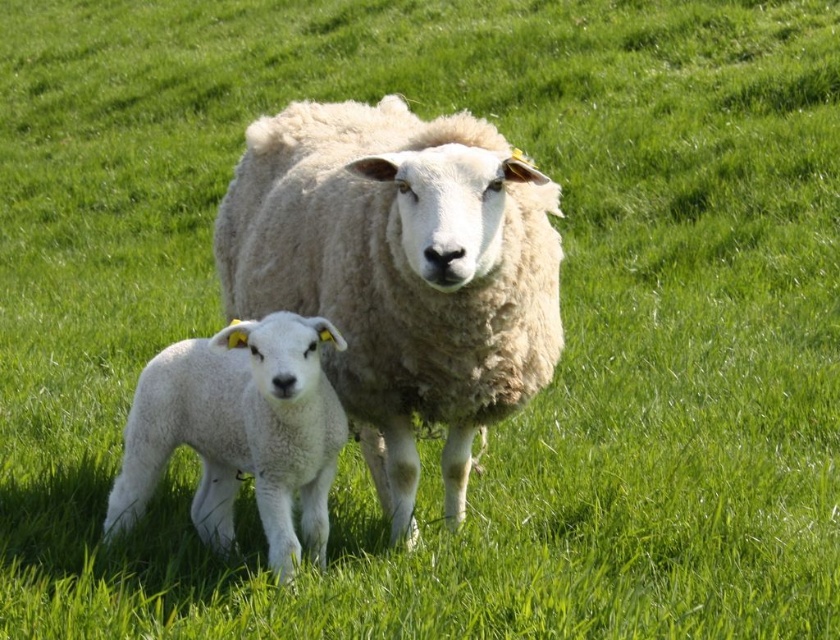
What do you see at coordinates (400, 273) in the screenshot? The width and height of the screenshot is (840, 640). I see `white woolen sheep at center` at bounding box center [400, 273].

How much distance is there between white woolen sheep at center and white woolen lamb at lower left?

A distance of 15.25 inches exists between white woolen sheep at center and white woolen lamb at lower left.

Who is more distant from viewer, [392,532] or [279,410]?

Point [392,532]

The width and height of the screenshot is (840, 640). Identify the location of white woolen sheep at center. (400, 273).